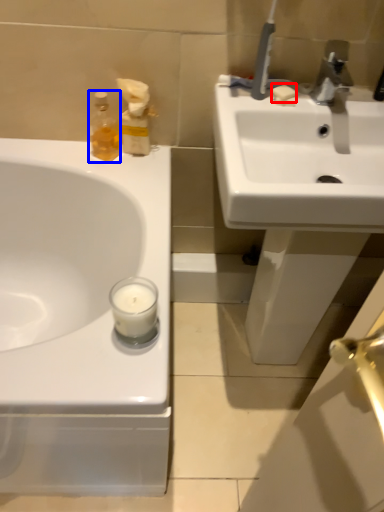
Question: Which object appears farthest to the camera in this image, soap (highlighted by a red box) or soap dispenser (highlighted by a blue box)?

Choices:
 (A) soap
 (B) soap dispenser

Answer: (B)